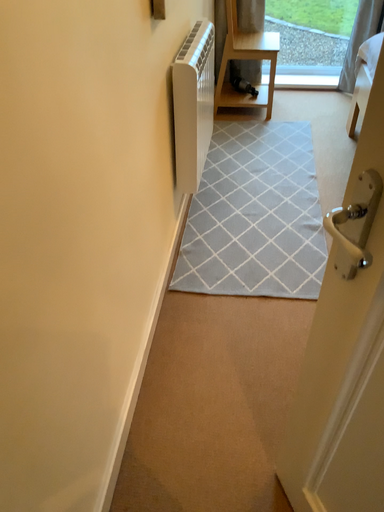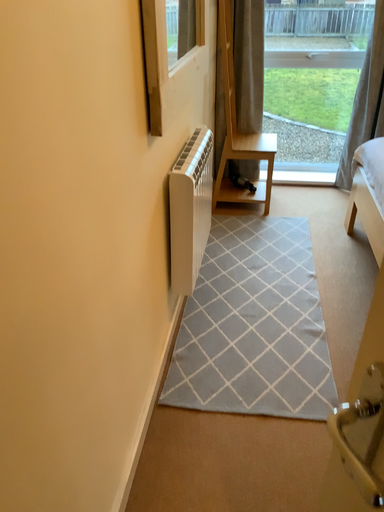
Question: How did the camera likely rotate when shooting the video?

Choices:
 (A) rotated upward
 (B) rotated downward

Answer: (A)